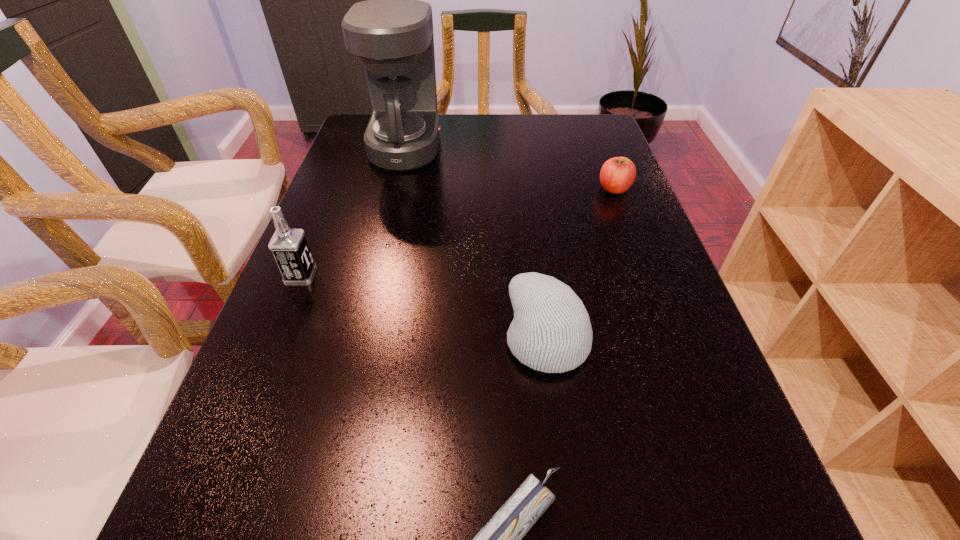
What are the coordinates of `vacant space located on the back of the fourth farthest object` in the screenshot? It's located at (532, 225).

Locate an element on the screen. vacant space located on the left of the second farthest object is located at coordinates tap(575, 189).

At what (x,y) coordinates should I click in order to perform the action: click on object that is at the far edge. Please return your answer as a coordinate pair (x, y). Looking at the image, I should click on (392, 32).

Identify the location of coffee maker situated at the left edge. (392, 32).

At what (x,y) coordinates should I click in order to perform the action: click on vodka present at the left edge. Please return your answer as a coordinate pair (x, y). The height and width of the screenshot is (540, 960). Looking at the image, I should click on (289, 247).

At what (x,y) coordinates should I click in order to perform the action: click on object that is at the right edge. Please return your answer as a coordinate pair (x, y). Looking at the image, I should click on (617, 174).

You are a GUI agent. You are given a task and a screenshot of the screen. Output one action in this format:
    pyautogui.click(x=<x>, y=<y>)
    Task: Click on the object at the far left corner
    
    Given the screenshot: What is the action you would take?
    pyautogui.click(x=392, y=32)

In the image, there is a desktop. Where is `free space at the left edge`? free space at the left edge is located at coordinates (329, 393).

At what (x,y) coordinates should I click in order to perform the action: click on free point at the right edge. Please return your answer as a coordinate pair (x, y). Looking at the image, I should click on (610, 272).

Find the location of a particular element. The height and width of the screenshot is (540, 960). vacant space at the far right corner of the desktop is located at coordinates (599, 122).